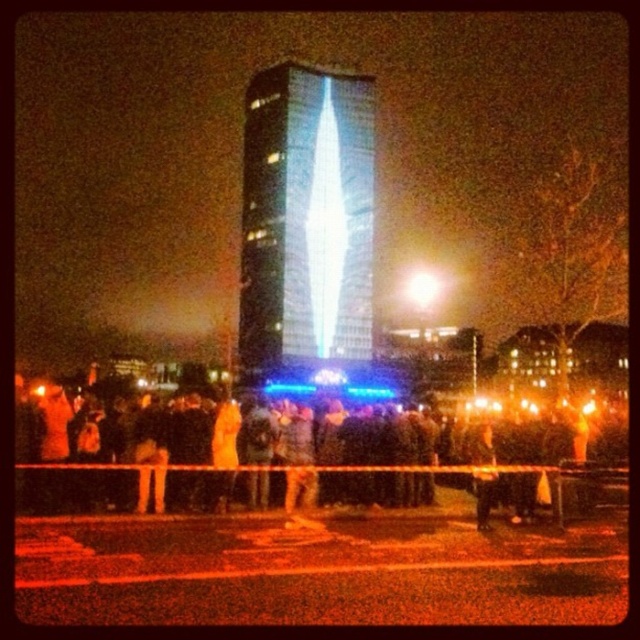
Can you confirm if black fabric crowd at center is smaller than transparent glass tower at center?

Incorrect, black fabric crowd at center is not smaller in size than transparent glass tower at center.

Is point (84, 470) in front of point (365, 104)?

Yes, it is.

Does point (483, 442) come farther from viewer compared to point (369, 269)?

No, (483, 442) is in front of (369, 269).

Locate an element on the screen. The image size is (640, 640). black fabric crowd at center is located at coordinates [289, 458].